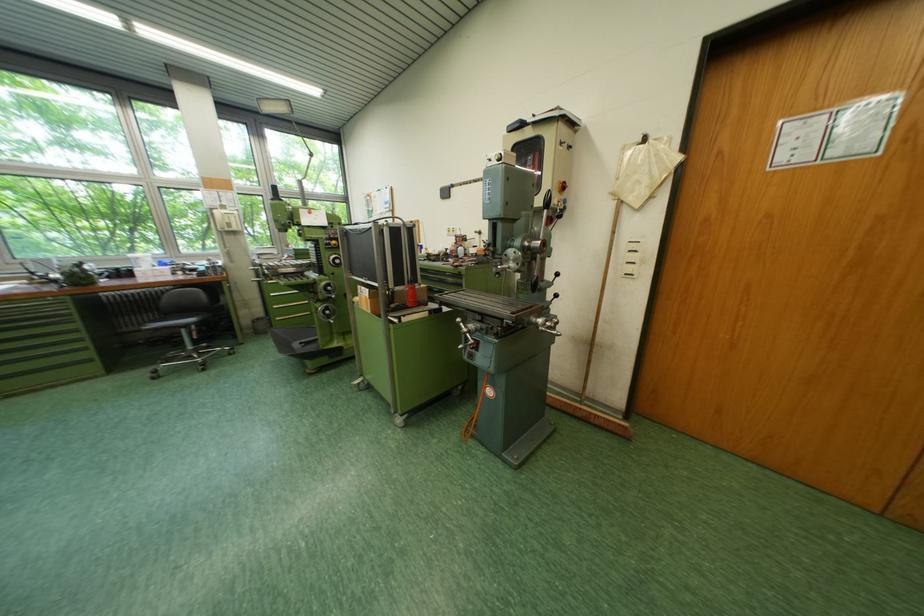
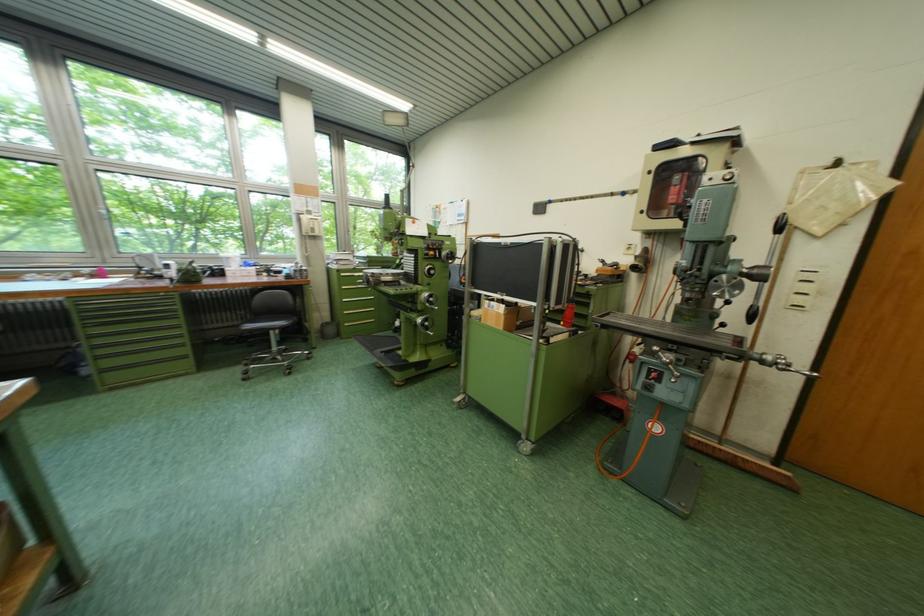
The point at (x=287, y=321) is marked in the first image. Where is the corresponding point in the second image?

(357, 326)